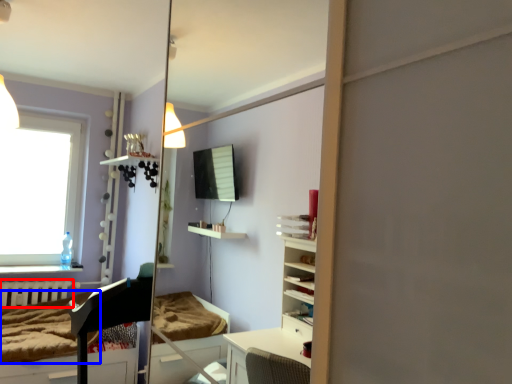
Question: Which object appears farthest to the camera in this image, radiator (highlighted by a red box) or mattress (highlighted by a blue box)?

Choices:
 (A) radiator
 (B) mattress

Answer: (A)